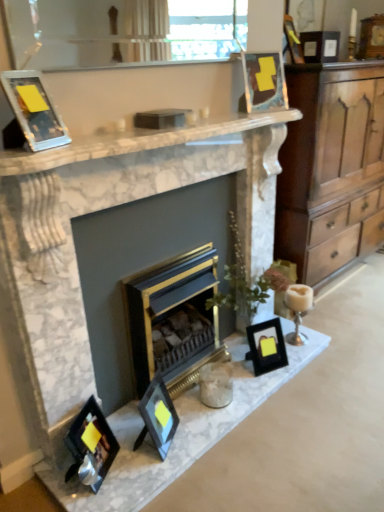
Question: Should I look upward or downward to see wooden picture frame at upper right, arranged as the 7th picture frame when viewed from the front?

Choices:
 (A) up
 (B) down

Answer: (A)

Question: Does matte black picture frame at center, arranged as the fifth picture frame when viewed from the right, have a greater height compared to matte black picture frame at lower left, placed as the sixth picture frame when sorted from right to left?

Choices:
 (A) yes
 (B) no

Answer: (B)

Question: Is matte black picture frame at center, positioned as the third picture frame in front-to-back order, smaller than matte black picture frame at lower left, placed as the sixth picture frame when sorted from right to left?

Choices:
 (A) no
 (B) yes

Answer: (B)

Question: Considering the relative positions of matte black picture frame at center, arranged as the fifth picture frame when viewed from the right, and matte black picture frame at lower left, placed as the sixth picture frame when sorted from right to left, in the image provided, is matte black picture frame at center, arranged as the fifth picture frame when viewed from the right, to the left of matte black picture frame at lower left, placed as the sixth picture frame when sorted from right to left, from the viewer's perspective?

Choices:
 (A) no
 (B) yes

Answer: (A)

Question: From the image's perspective, would you say matte black picture frame at center, the 3th picture frame when ordered from left to right, is shown under matte black picture frame at lower left, which is counted as the sixth picture frame, starting from the back?

Choices:
 (A) yes
 (B) no

Answer: (B)

Question: Is matte black picture frame at center, the sixth picture frame in the top-to-bottom sequence, aimed at matte black picture frame at lower left, which is the 7th picture frame in top-to-bottom order?

Choices:
 (A) yes
 (B) no

Answer: (B)

Question: Considering the relative positions of matte black picture frame at center, arranged as the fifth picture frame when viewed from the right, and matte black picture frame at lower left, which is counted as the 2th picture frame, starting from the front, in the image provided, is matte black picture frame at center, arranged as the fifth picture frame when viewed from the right, in front of matte black picture frame at lower left, which is counted as the 2th picture frame, starting from the front,?

Choices:
 (A) yes
 (B) no

Answer: (B)

Question: From a real-world perspective, is metallic gold picture frame at upper center, marked as the 4th picture frame in a right-to-left arrangement, physically above matte black picture frame at center, the 3th picture frame when ordered from left to right?

Choices:
 (A) no
 (B) yes

Answer: (B)

Question: Is metallic gold picture frame at upper center, marked as the 4th picture frame in a left-to-right arrangement, closer to the viewer compared to matte black picture frame at center, positioned as the third picture frame in front-to-back order?

Choices:
 (A) yes
 (B) no

Answer: (B)

Question: Considering the relative sizes of metallic gold picture frame at upper center, marked as the 4th picture frame in a left-to-right arrangement, and matte black picture frame at center, arranged as the fifth picture frame when viewed from the right, in the image provided, is metallic gold picture frame at upper center, marked as the 4th picture frame in a left-to-right arrangement, wider than matte black picture frame at center, arranged as the fifth picture frame when viewed from the right,?

Choices:
 (A) no
 (B) yes

Answer: (A)

Question: Considering the relative positions of metallic gold picture frame at upper center, marked as the 4th picture frame in a right-to-left arrangement, and matte black picture frame at center, the second picture frame ordered from the bottom, in the image provided, is metallic gold picture frame at upper center, marked as the 4th picture frame in a right-to-left arrangement, to the right of matte black picture frame at center, the second picture frame ordered from the bottom, from the viewer's perspective?

Choices:
 (A) yes
 (B) no

Answer: (A)

Question: Can you confirm if metallic gold picture frame at upper center, marked as the 4th picture frame in a left-to-right arrangement, is taller than matte black picture frame at center, positioned as the third picture frame in front-to-back order?

Choices:
 (A) no
 (B) yes

Answer: (A)

Question: Is the depth of metallic gold picture frame at upper center, the 3th picture frame viewed from the top, greater than that of matte black picture frame at center, the second picture frame ordered from the bottom?

Choices:
 (A) no
 (B) yes

Answer: (B)

Question: Would you say marble fireplace at center, marked as the 2th fireplace in a right-to-left arrangement, is part of wooden picture frame at upper right, the 1th picture frame positioned from the back,'s contents?

Choices:
 (A) yes
 (B) no

Answer: (B)